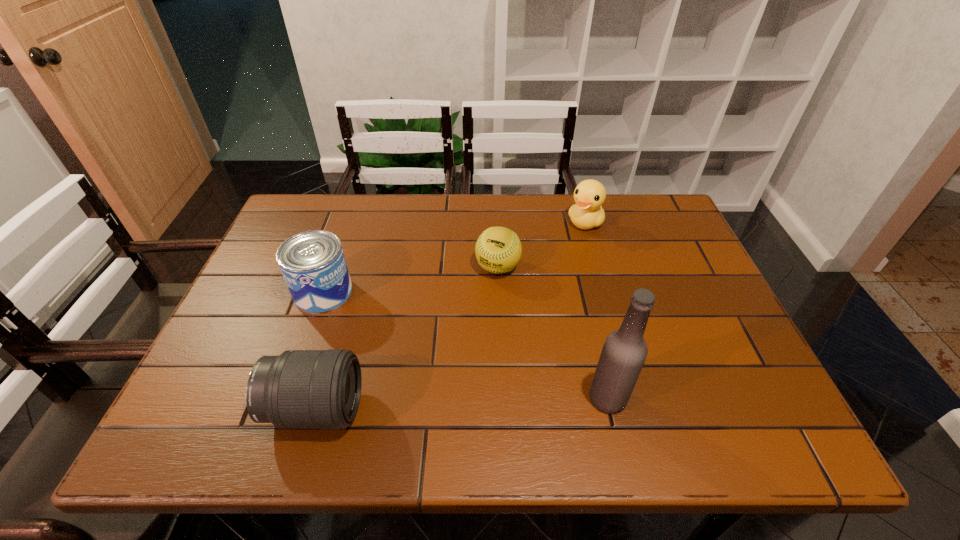
I want to click on vacant spot on the desktop that is between the telephoto lens and the beer bottle and is positioned on the logo side of the third object from left to right, so [x=426, y=404].

Locate an element on the screen. This screenshot has width=960, height=540. vacant space on the desktop that is between the telephoto lens and the beer bottle and is positioned on the face of the farthest object is located at coordinates click(439, 404).

Where is `vacant space on the desktop that is between the telephoto lens and the beer bottle and is positioned on the front label of the can`? The height and width of the screenshot is (540, 960). vacant space on the desktop that is between the telephoto lens and the beer bottle and is positioned on the front label of the can is located at coordinates (440, 404).